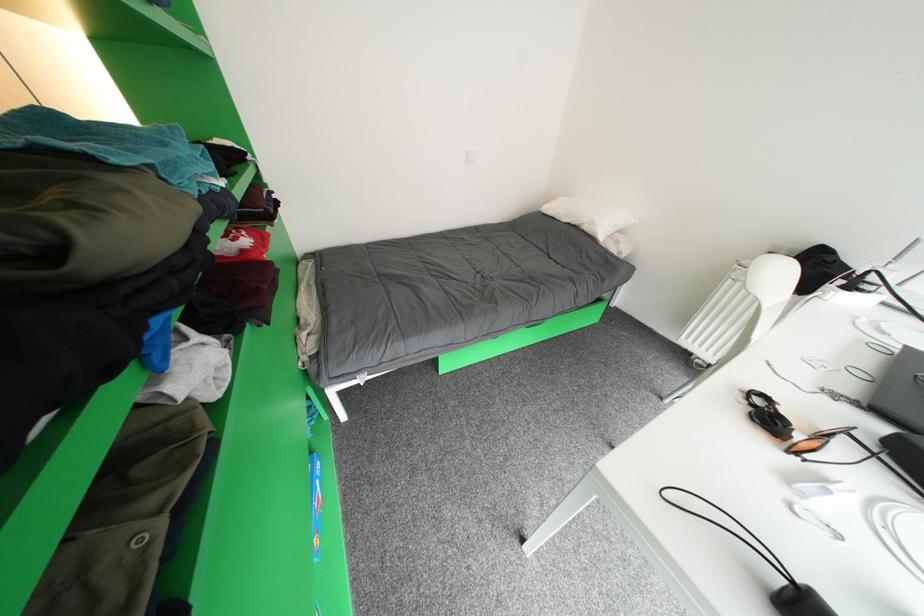
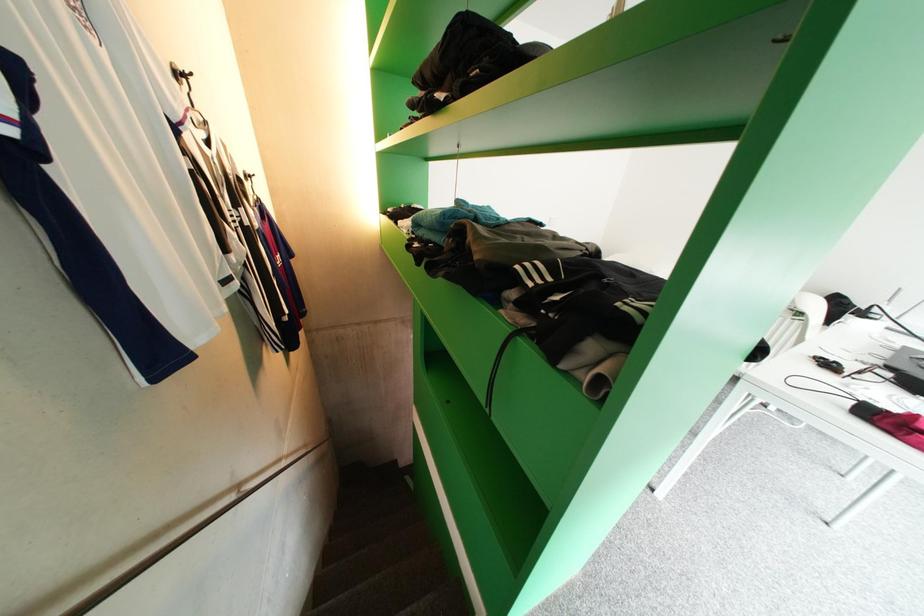
What movement of the cameraman would produce the second image?

The movement direction of the cameraman is left, backward.